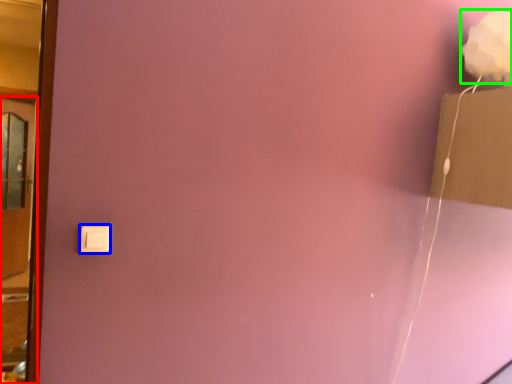
Question: Considering the real-world distances, which object is farthest from door (highlighted by a red box)? light switch (highlighted by a blue box) or flower (highlighted by a green box)?

Choices:
 (A) light switch
 (B) flower

Answer: (B)